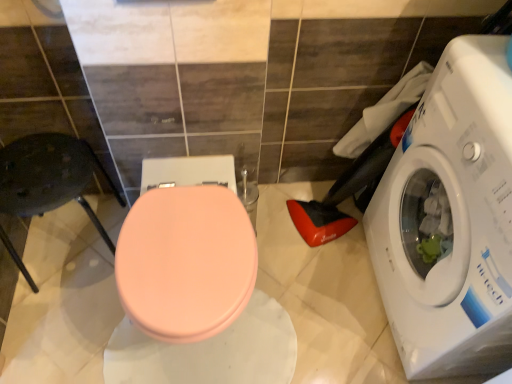
Find the location of `free point below metallic dark gray chair at left (from a real-world perspective)`. free point below metallic dark gray chair at left (from a real-world perspective) is located at coordinates (78, 252).